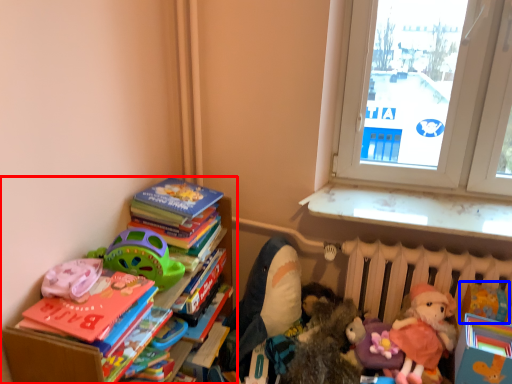
Question: Among these objects, which one is nearest to the camera, bookcase (highlighted by a red box) or toy (highlighted by a blue box)?

Choices:
 (A) bookcase
 (B) toy

Answer: (A)